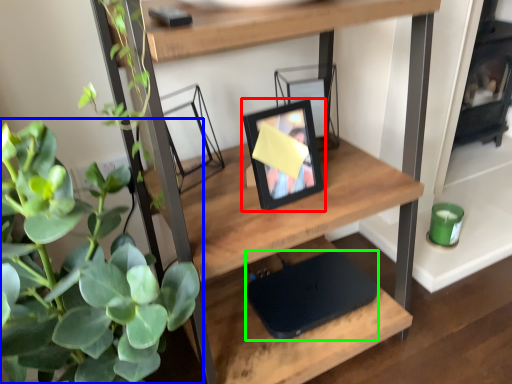
Question: Which object is the farthest from picture frame (highlighted by a red box)? Choose among these: houseplant (highlighted by a blue box) or laptop (highlighted by a green box).

Choices:
 (A) houseplant
 (B) laptop

Answer: (A)